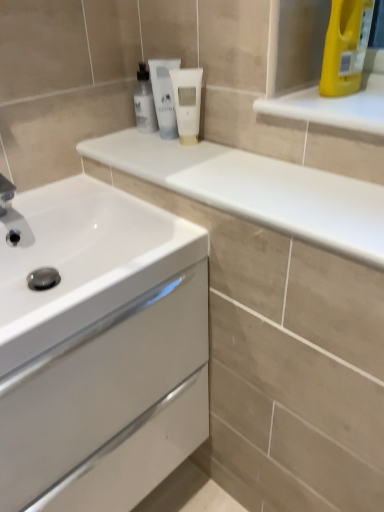
Locate an element on the screen. The width and height of the screenshot is (384, 512). free space to the right of brushed metal faucet at left is located at coordinates (73, 203).